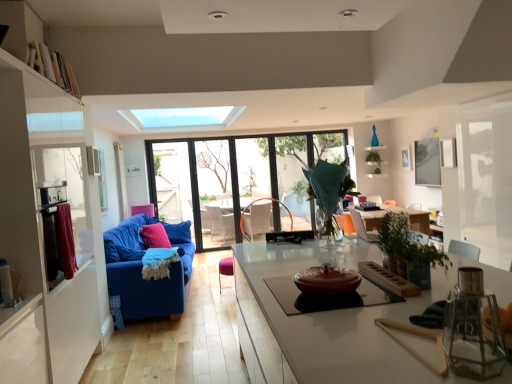
Question: Considering the relative sizes of translucent glass vase at center, which appears as the 3th plant when viewed from the right, and pink fabric pillow at center in the image provided, is translucent glass vase at center, which appears as the 3th plant when viewed from the right, bigger than pink fabric pillow at center?

Choices:
 (A) no
 (B) yes

Answer: (B)

Question: From a real-world perspective, does translucent glass vase at center, which appears as the 3th plant when viewed from the right, stand above pink fabric pillow at center?

Choices:
 (A) yes
 (B) no

Answer: (A)

Question: Can you confirm if translucent glass vase at center, the 3th plant from the back, is thinner than pink fabric pillow at center?

Choices:
 (A) no
 (B) yes

Answer: (A)

Question: Is translucent glass vase at center, marked as the first plant in a front-to-back arrangement, directly adjacent to pink fabric pillow at center?

Choices:
 (A) no
 (B) yes

Answer: (A)

Question: Considering the relative sizes of translucent glass vase at center, which appears as the first plant when viewed from the left, and pink fabric pillow at center in the image provided, is translucent glass vase at center, which appears as the first plant when viewed from the left, wider than pink fabric pillow at center?

Choices:
 (A) no
 (B) yes

Answer: (B)

Question: Is translucent glass vase at center, marked as the first plant in a front-to-back arrangement, to the right of pink fabric pillow at center from the viewer's perspective?

Choices:
 (A) no
 (B) yes

Answer: (B)

Question: Is maroon fabric curtain at left completely or partially inside transparent glass window at center?

Choices:
 (A) no
 (B) yes

Answer: (A)

Question: Is transparent glass window at center positioned with its back to maroon fabric curtain at left?

Choices:
 (A) yes
 (B) no

Answer: (B)

Question: Is transparent glass window at center in contact with maroon fabric curtain at left?

Choices:
 (A) no
 (B) yes

Answer: (A)

Question: From a real-world perspective, is transparent glass window at center positioned over maroon fabric curtain at left based on gravity?

Choices:
 (A) no
 (B) yes

Answer: (A)

Question: Does transparent glass window at center have a lesser width compared to maroon fabric curtain at left?

Choices:
 (A) yes
 (B) no

Answer: (B)

Question: Is transparent glass window at center oriented towards maroon fabric curtain at left?

Choices:
 (A) no
 (B) yes

Answer: (B)

Question: From a real-world perspective, is blue fabric couch at left below blue fabric couch at left?

Choices:
 (A) yes
 (B) no

Answer: (B)